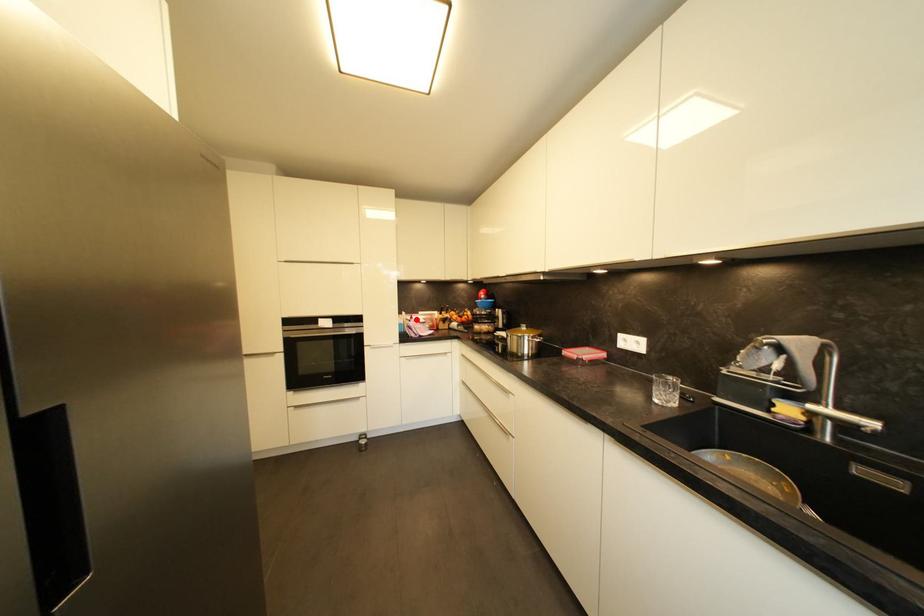
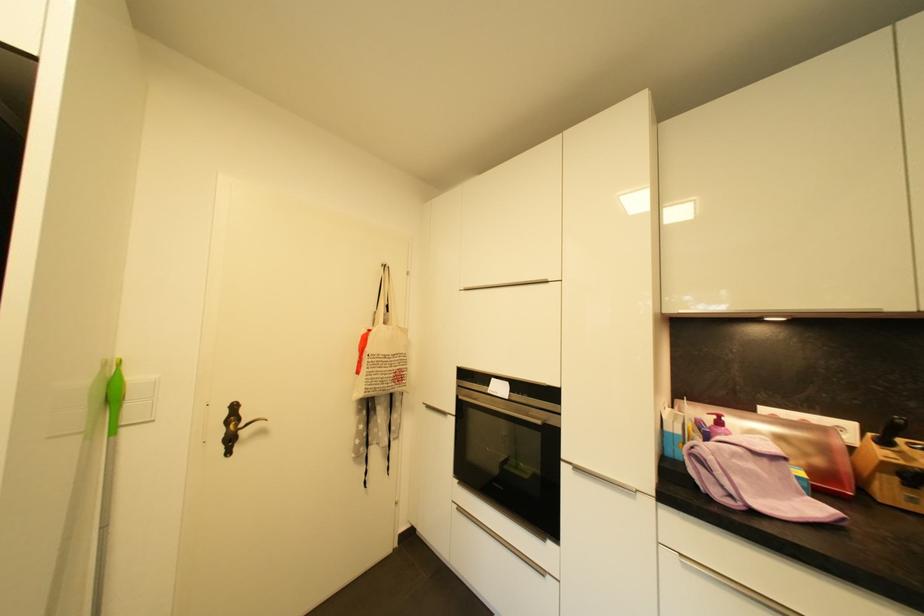
Where in the second image is the point corresponding to the highlighted location from the first image?

(724, 424)